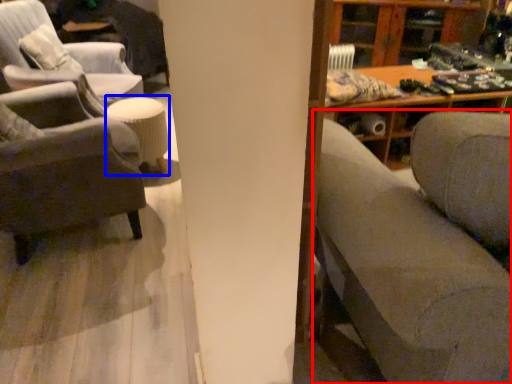
Question: Which object is closer to the camera taking this photo, studio couch (highlighted by a red box) or stool (highlighted by a blue box)?

Choices:
 (A) studio couch
 (B) stool

Answer: (A)